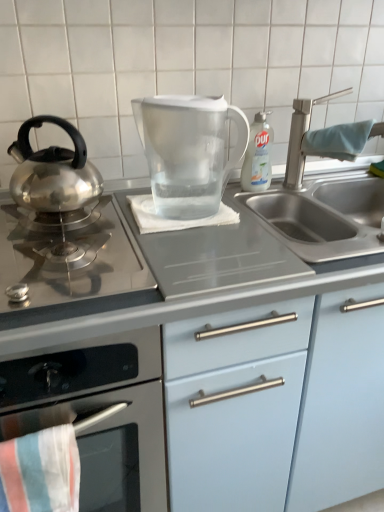
Question: Which direction should I rotate to face white cloth at center, marked as the second beach towel in a right-to-left arrangement, — up or down?

Choices:
 (A) down
 (B) up

Answer: (B)

Question: Is blue fabric towel at sink right, which ranks as the first beach towel in top-to-bottom order, wider than satin nickel faucet at upper right?

Choices:
 (A) no
 (B) yes

Answer: (A)

Question: From the image's perspective, would you say blue fabric towel at sink right, the first beach towel when ordered from back to front, is shown under satin nickel faucet at upper right?

Choices:
 (A) yes
 (B) no

Answer: (A)

Question: Is the depth of blue fabric towel at sink right, which is counted as the third beach towel, starting from the bottom, less than that of satin nickel faucet at upper right?

Choices:
 (A) no
 (B) yes

Answer: (A)

Question: Is blue fabric towel at sink right, which is counted as the third beach towel, starting from the bottom, bigger than satin nickel faucet at upper right?

Choices:
 (A) no
 (B) yes

Answer: (A)

Question: Considering the relative positions of blue fabric towel at sink right, which ranks as the 3th beach towel in left-to-right order, and satin nickel faucet at upper right in the image provided, is blue fabric towel at sink right, which ranks as the 3th beach towel in left-to-right order, behind satin nickel faucet at upper right?

Choices:
 (A) yes
 (B) no

Answer: (A)

Question: Is satin nickel faucet at upper right located within blue fabric towel at sink right, which ranks as the first beach towel in top-to-bottom order?

Choices:
 (A) no
 (B) yes

Answer: (A)

Question: Does striped cotton beach towel at lower left, which is the 3th beach towel from back to front, have a greater width compared to white cloth at center, the 2th beach towel viewed from the left?

Choices:
 (A) no
 (B) yes

Answer: (A)

Question: Considering the relative sizes of striped cotton beach towel at lower left, placed as the 3th beach towel when sorted from right to left, and white cloth at center, acting as the 2th beach towel starting from the front, in the image provided, is striped cotton beach towel at lower left, placed as the 3th beach towel when sorted from right to left, taller than white cloth at center, acting as the 2th beach towel starting from the front,?

Choices:
 (A) yes
 (B) no

Answer: (A)

Question: Is white cloth at center, the 2th beach towel in the top-to-bottom sequence, located within striped cotton beach towel at lower left, the first beach towel viewed from the left?

Choices:
 (A) no
 (B) yes

Answer: (A)

Question: From a real-world perspective, is striped cotton beach towel at lower left, the first beach towel viewed from the left, under white cloth at center, marked as the second beach towel in a right-to-left arrangement?

Choices:
 (A) no
 (B) yes

Answer: (B)

Question: Is striped cotton beach towel at lower left, the 1th beach towel positioned from the front, positioned with its back to white cloth at center, acting as the 2th beach towel starting from the front?

Choices:
 (A) no
 (B) yes

Answer: (A)

Question: Does striped cotton beach towel at lower left, which is the 3th beach towel from back to front, come in front of white cloth at center, acting as the 2th beach towel starting from the front?

Choices:
 (A) no
 (B) yes

Answer: (B)

Question: Does stainless steel kettle at left, which ranks as the third kitchen appliance in top-to-bottom order, have a smaller size compared to satin silver gas stove at left?

Choices:
 (A) yes
 (B) no

Answer: (B)